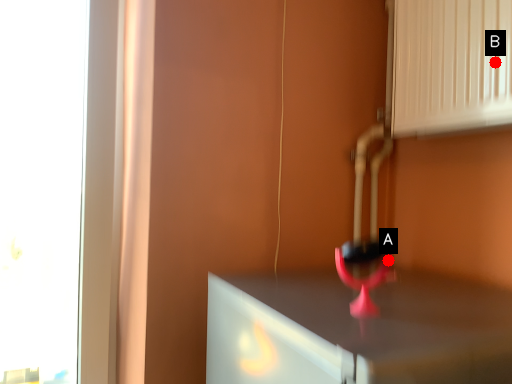
Question: Two points are circled on the image, labeled by A and B beside each circle. Which point appears closest to the camera in this image?

Choices:
 (A) A is closer
 (B) B is closer

Answer: (A)